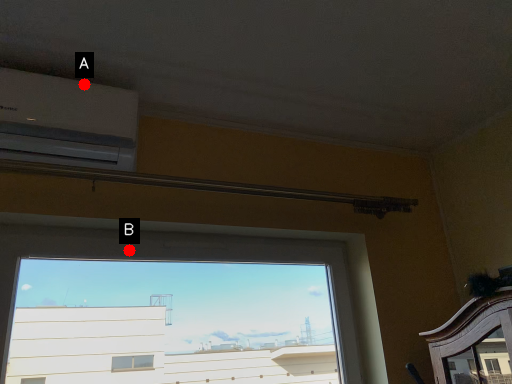
Question: Two points are circled on the image, labeled by A and B beside each circle. Among these points, which one is nearest to the camera?

Choices:
 (A) A is closer
 (B) B is closer

Answer: (A)